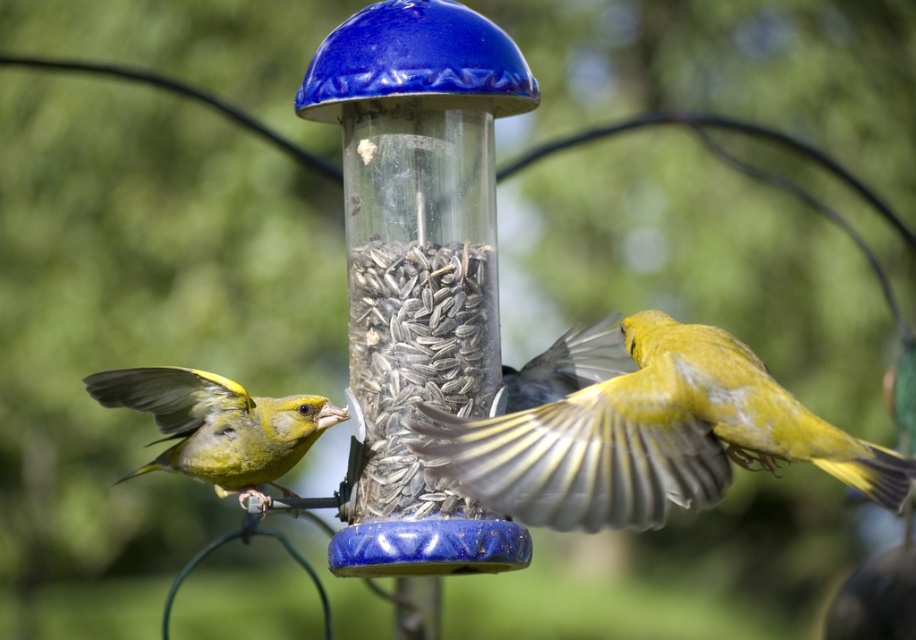
Does transparent plastic bird feeder at center appear under gray textured seeds at center?

No, transparent plastic bird feeder at center is not below gray textured seeds at center.

Is point (442, 502) positioned behind point (410, 460)?

No, it is in front of (410, 460).

Locate an element on the screen. transparent plastic bird feeder at center is located at coordinates point(418,262).

Between transparent plastic bird feeder at center and yellow feathered bird at center, which one has more height?

With more height is transparent plastic bird feeder at center.

Who is positioned more to the right, transparent plastic bird feeder at center or yellow feathered bird at center?

From the viewer's perspective, yellow feathered bird at center appears more on the right side.

Is point (443, 228) more distant than point (754, 433)?

Yes, it is.

The image size is (916, 640). I want to click on transparent plastic bird feeder at center, so click(418, 262).

Based on the photo, can you confirm if yellow feathered bird at center is shorter than green matte bird at left?

No, yellow feathered bird at center is not shorter than green matte bird at left.

Is yellow feathered bird at center thinner than green matte bird at left?

No, yellow feathered bird at center is not thinner than green matte bird at left.

Is point (680, 420) positioned behind point (293, 413)?

No, it is in front of (293, 413).

Find the location of `yellow feathered bird at center`. yellow feathered bird at center is located at coordinates (650, 436).